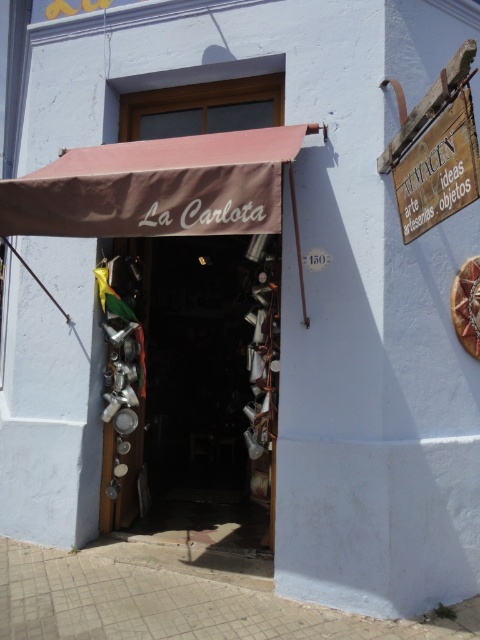
Between metallic pots at center and wooden sign at upper right, which one is positioned higher?

wooden sign at upper right is higher up.

Is point (158, 417) less distant than point (433, 180)?

No, it is not.

Who is more distant from viewer, (x=216, y=305) or (x=403, y=177)?

The point (x=216, y=305) is behind.

Locate an element on the screen. metallic pots at center is located at coordinates (193, 387).

Can you confirm if metallic pots at center is shorter than brown fabric awning at upper center?

No.

Looking at this image, does metallic pots at center appear under brown fabric awning at upper center?

Yes.

Describe the element at coordinates (193, 387) in the screenshot. This screenshot has height=640, width=480. I see `metallic pots at center` at that location.

You are a GUI agent. You are given a task and a screenshot of the screen. Output one action in this format:
    pyautogui.click(x=<x>, y=<y>)
    Task: Click on the metallic pots at center
    This screenshot has height=640, width=480.
    Given the screenshot: What is the action you would take?
    pyautogui.click(x=193, y=387)

Is brown fabric awning at upper center smaller than wooden sign at upper right?

No, brown fabric awning at upper center is not smaller than wooden sign at upper right.

Describe the element at coordinates (156, 186) in the screenshot. I see `brown fabric awning at upper center` at that location.

Where is `brown fabric awning at upper center`? This screenshot has height=640, width=480. brown fabric awning at upper center is located at coordinates [156, 186].